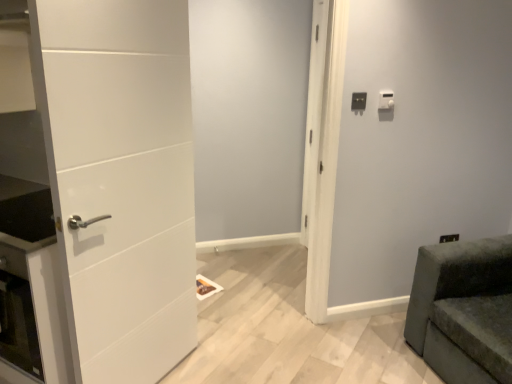
Question: Considering the relative sizes of white matte door at left and white plastic light switch at upper right, the 1th light switch viewed from the right, in the image provided, is white matte door at left bigger than white plastic light switch at upper right, the 1th light switch viewed from the right,?

Choices:
 (A) no
 (B) yes

Answer: (B)

Question: Is white matte door at left in front of white plastic light switch at upper right, the 1th light switch viewed from the right?

Choices:
 (A) yes
 (B) no

Answer: (A)

Question: Is white plastic light switch at upper right, positioned as the second light switch in left-to-right order, at the back of white matte door at left?

Choices:
 (A) no
 (B) yes

Answer: (A)

Question: From a real-world perspective, is white matte door at left located higher than white plastic light switch at upper right, the 1th light switch viewed from the right?

Choices:
 (A) yes
 (B) no

Answer: (B)

Question: From the image's perspective, is white matte door at left located above white plastic light switch at upper right, the 1th light switch viewed from the right?

Choices:
 (A) no
 (B) yes

Answer: (A)

Question: Considering their positions, is white matte door at center located in front of or behind velvet green sofa at lower right?

Choices:
 (A) behind
 (B) front

Answer: (A)

Question: In terms of size, does white matte door at center appear bigger or smaller than velvet green sofa at lower right?

Choices:
 (A) small
 (B) big

Answer: (A)

Question: In the image, is white matte door at center on the left side or the right side of velvet green sofa at lower right?

Choices:
 (A) right
 (B) left

Answer: (B)

Question: Considering the positions of point (279, 105) and point (465, 274), is point (279, 105) closer or farther from the camera than point (465, 274)?

Choices:
 (A) farther
 (B) closer

Answer: (A)

Question: In the image, is white plastic light switch at upper right, arranged as the 1th light switch when viewed from the left, positioned in front of or behind velvet green sofa at lower right?

Choices:
 (A) front
 (B) behind

Answer: (B)

Question: In terms of height, does white plastic light switch at upper right, the 2th light switch viewed from the right, look taller or shorter compared to velvet green sofa at lower right?

Choices:
 (A) short
 (B) tall

Answer: (A)

Question: Is white plastic light switch at upper right, the 2th light switch viewed from the right, situated inside velvet green sofa at lower right or outside?

Choices:
 (A) inside
 (B) outside

Answer: (B)

Question: From a real-world perspective, relative to velvet green sofa at lower right, is white plastic light switch at upper right, the 2th light switch viewed from the right, vertically above or below?

Choices:
 (A) below
 (B) above

Answer: (B)

Question: Is point (354, 102) positioned closer to the camera than point (384, 107)?

Choices:
 (A) farther
 (B) closer

Answer: (B)

Question: Considering the positions of white plastic light switch at upper right, the 2th light switch viewed from the right, and white plastic light switch at upper right, the 1th light switch viewed from the right, in the image, is white plastic light switch at upper right, the 2th light switch viewed from the right, bigger or smaller than white plastic light switch at upper right, the 1th light switch viewed from the right,?

Choices:
 (A) small
 (B) big

Answer: (A)